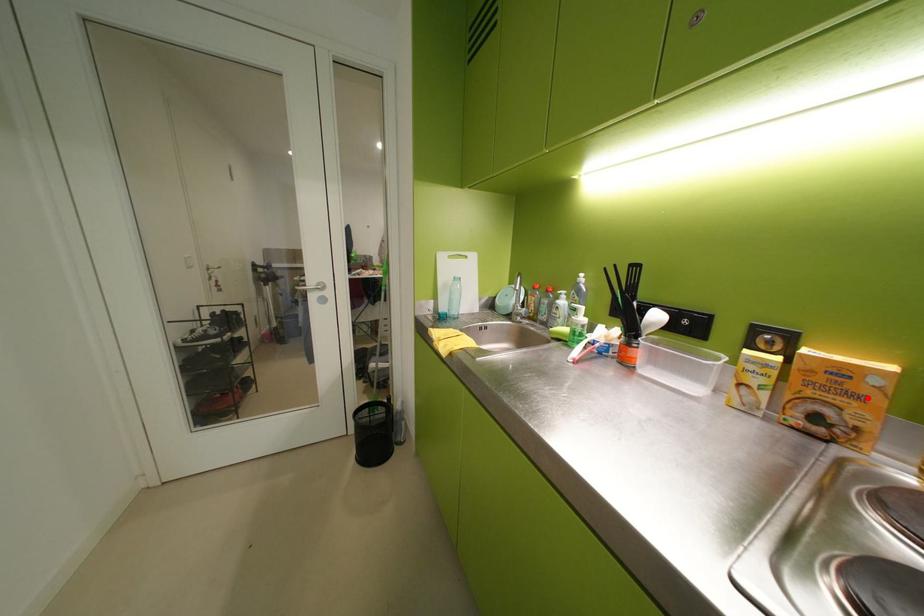
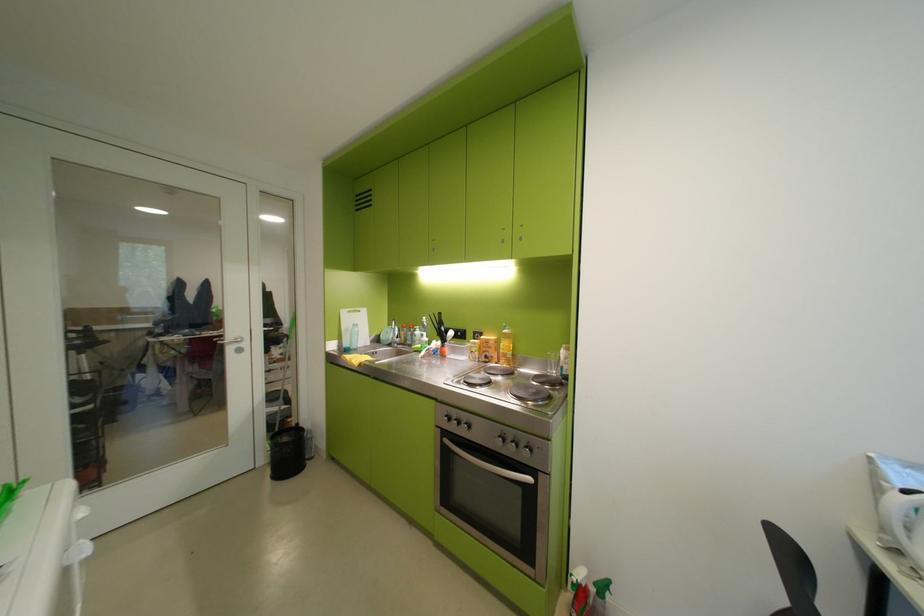
In the second image, find the point that corresponds to the highlighted location in the first image.

(501, 349)